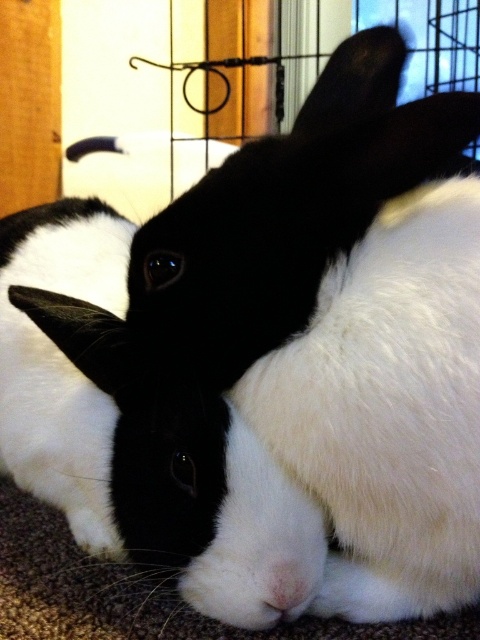
Is wooden screen door at upper left smaller than white soft fur nose at center?

No, wooden screen door at upper left is not smaller than white soft fur nose at center.

Between wooden screen door at upper left and white soft fur nose at center, which one appears on the right side from the viewer's perspective?

Positioned to the right is white soft fur nose at center.

The width and height of the screenshot is (480, 640). Describe the element at coordinates (29, 102) in the screenshot. I see `wooden screen door at upper left` at that location.

This screenshot has height=640, width=480. I want to click on wooden screen door at upper left, so click(x=29, y=102).